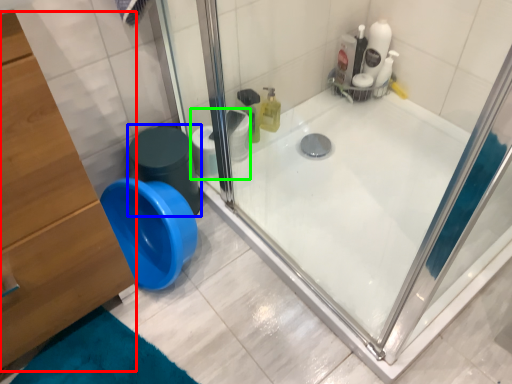
Question: Considering the real-world distances, which object is farthest from dresser (highlighted by a red box)? potty (highlighted by a blue box) or toilet paper (highlighted by a green box)?

Choices:
 (A) potty
 (B) toilet paper

Answer: (B)